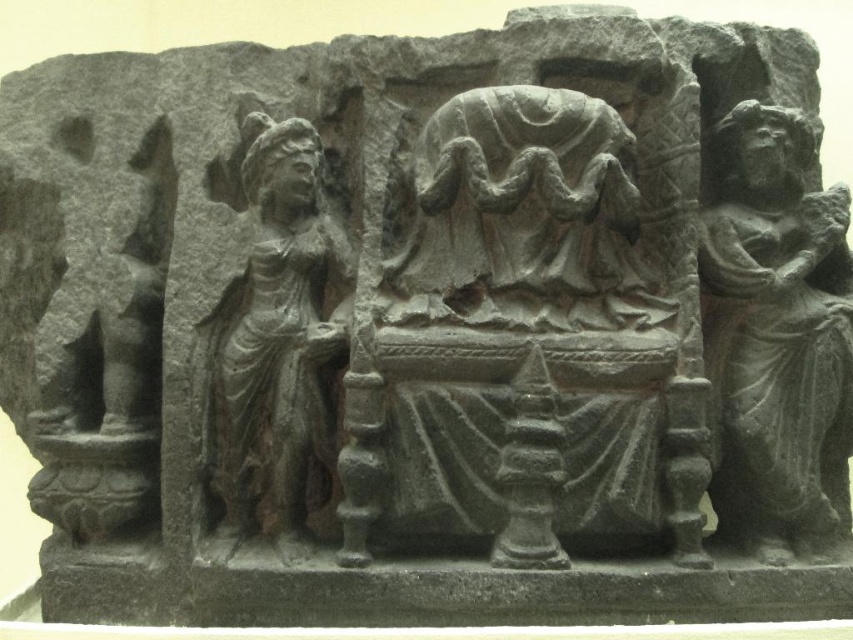
Does gray stone figure at center appear over dark gray stone figure at left?

Correct, gray stone figure at center is located above dark gray stone figure at left.

Can you confirm if gray stone figure at center is taller than dark gray stone figure at left?

No, gray stone figure at center is not taller than dark gray stone figure at left.

Measure the distance between gray stone figure at center and camera.

5.16 feet

Image resolution: width=853 pixels, height=640 pixels. Find the location of `gray stone figure at center`. gray stone figure at center is located at coordinates (524, 216).

Does point (838, 460) come farther from viewer compared to point (341, 269)?

Yes, it is.

Who is higher up, dark gray stone figure at right or dark gray stone figure at left?

dark gray stone figure at right

Does point (839, 312) come farther from viewer compared to point (215, 330)?

No, it is in front of (215, 330).

Find the location of a particular element. dark gray stone figure at right is located at coordinates (776, 336).

Who is positioned more to the left, dark gray stone figure at right or gray stone figure at center?

Positioned to the left is gray stone figure at center.

Which is below, dark gray stone figure at right or gray stone figure at center?

dark gray stone figure at right is lower down.

At what (x,y) coordinates should I click in order to perform the action: click on dark gray stone figure at right. Please return your answer as a coordinate pair (x, y). The height and width of the screenshot is (640, 853). Looking at the image, I should click on (776, 336).